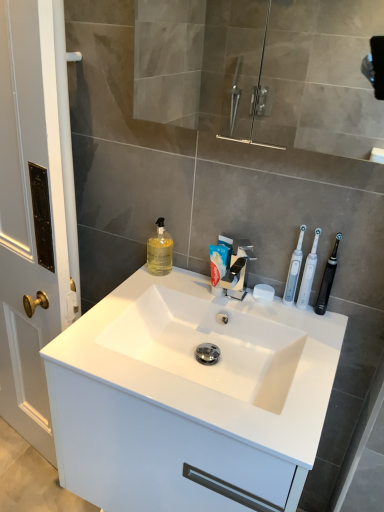
Image resolution: width=384 pixels, height=512 pixels. What are the coordinates of `vacant area that lies to the right of white matte toothpaste at center` in the screenshot? It's located at (273, 312).